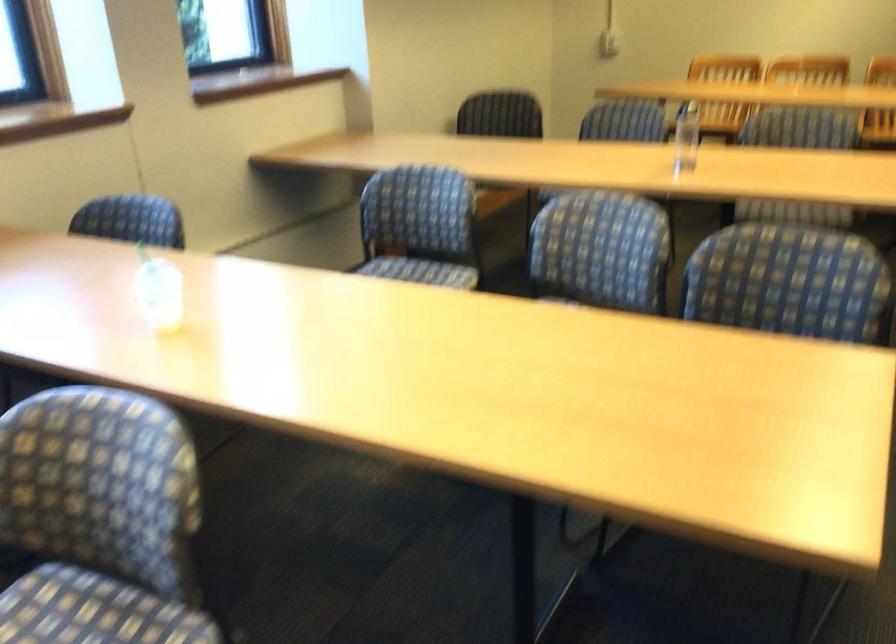
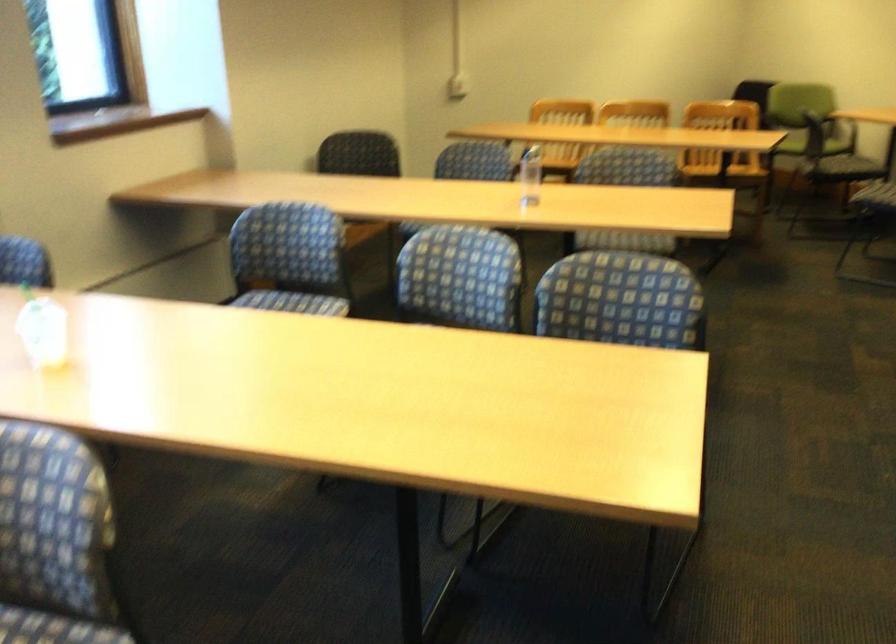
Question: Which direction would the cameraman need to move to produce the second image? Reply with the corresponding letter.

Choices:
 (A) Left
 (B) Right
 (C) Forward
 (D) Backward

Answer: (D)